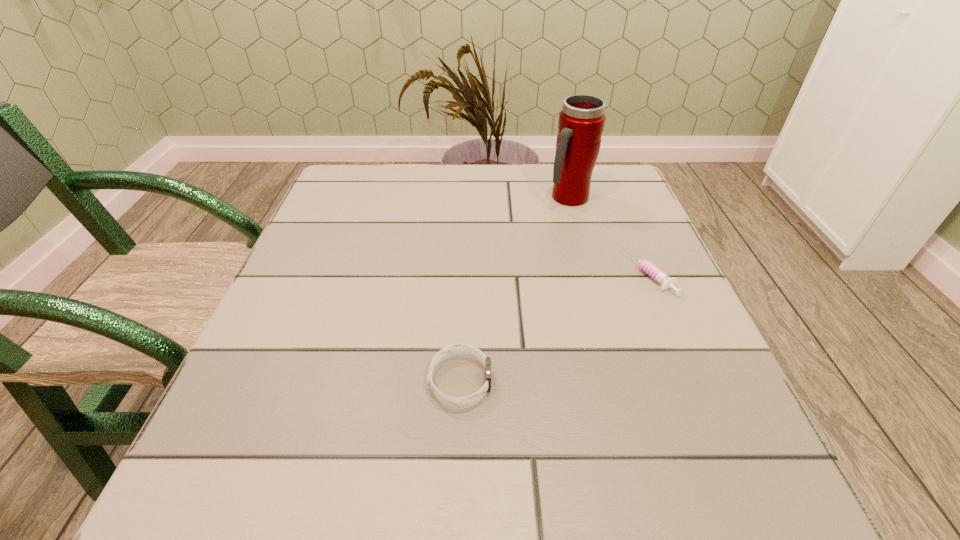
The height and width of the screenshot is (540, 960). I want to click on the farthest object, so click(581, 122).

Identify the location of the second object from left to right. This screenshot has height=540, width=960. (581, 122).

The image size is (960, 540). I want to click on wristband, so click(x=453, y=349).

Where is `the second shortest object`? The height and width of the screenshot is (540, 960). the second shortest object is located at coordinates (453, 349).

The width and height of the screenshot is (960, 540). I want to click on the shortest object, so click(664, 280).

Where is `the rightmost object`? Image resolution: width=960 pixels, height=540 pixels. the rightmost object is located at coordinates (664, 280).

The height and width of the screenshot is (540, 960). What are the coordinates of `vacant space situated 0.100m on the side with the handle of the tallest object` in the screenshot? It's located at (580, 237).

Identify the location of vacant region located on the outer surface of the leftmost object. coord(542,381).

This screenshot has height=540, width=960. I want to click on vacant space located 0.290m on the back of the second nearest object, so click(x=609, y=180).

This screenshot has width=960, height=540. What are the coordinates of `object situated at the far edge` in the screenshot? It's located at (581, 122).